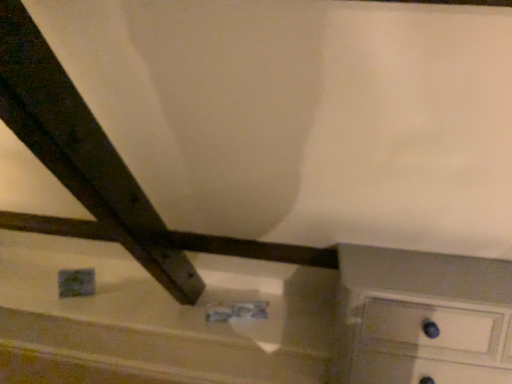
This screenshot has width=512, height=384. Describe the element at coordinates (422, 318) in the screenshot. I see `white glossy file cabinet at lower right` at that location.

The width and height of the screenshot is (512, 384). Find the location of `white glossy file cabinet at lower right`. white glossy file cabinet at lower right is located at coordinates (422, 318).

Image resolution: width=512 pixels, height=384 pixels. Identify the location of white glossy file cabinet at lower right. (422, 318).